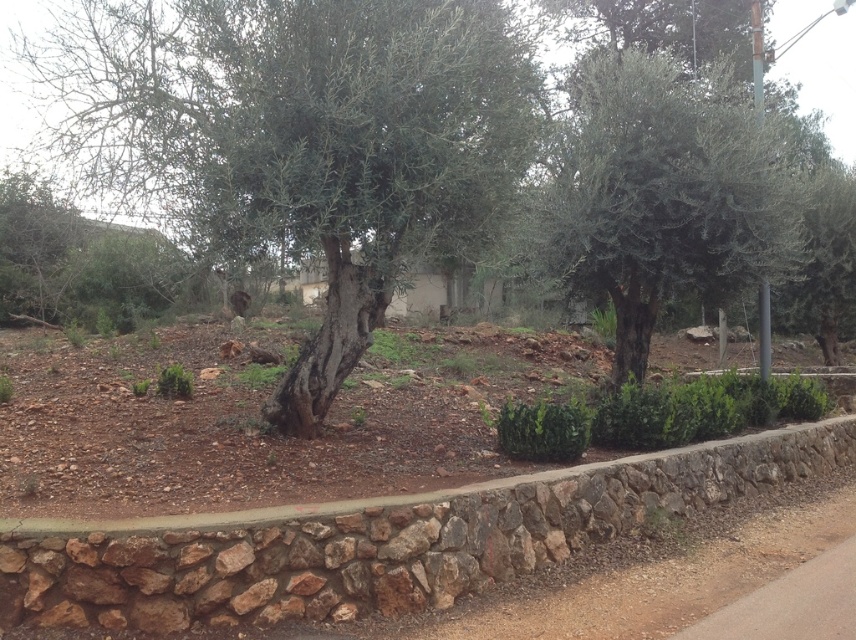
Between point (348, 177) and point (615, 150), which one is positioned behind?

The point (615, 150) is behind.

The image size is (856, 640). I want to click on green rough bark tree at center, so click(x=304, y=138).

Where is `green rough bark tree at center`? This screenshot has width=856, height=640. green rough bark tree at center is located at coordinates (304, 138).